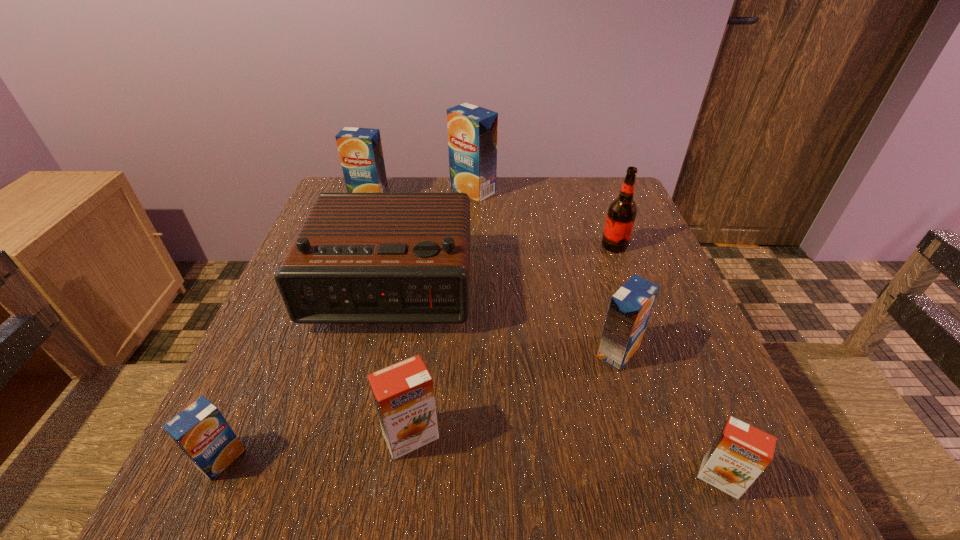
What are the coordinates of `blue orange_juice identified as the fourth closest to the left orange orange juice` in the screenshot? It's located at (472, 130).

Point out which blue orange_juice is positioned as the second nearest to the second tallest orange juice. Please provide its 2D coordinates. Your answer should be formatted as a tuple, i.e. [(x, y)], where the tuple contains the x and y coordinates of a point satisfying the conditions above.

[(630, 308)]

Identify the location of vacant region that satisfies the following two spatial constraints: 1. on the front panel of the brown radio receiver; 2. on the right side of the smaller orange orange juice. This screenshot has width=960, height=540. (343, 478).

Identify the location of free location that satisfies the following two spatial constraints: 1. on the back side of the biggest blue orange_juice; 2. on the left side of the nearest blue orange_juice. This screenshot has width=960, height=540. (344, 191).